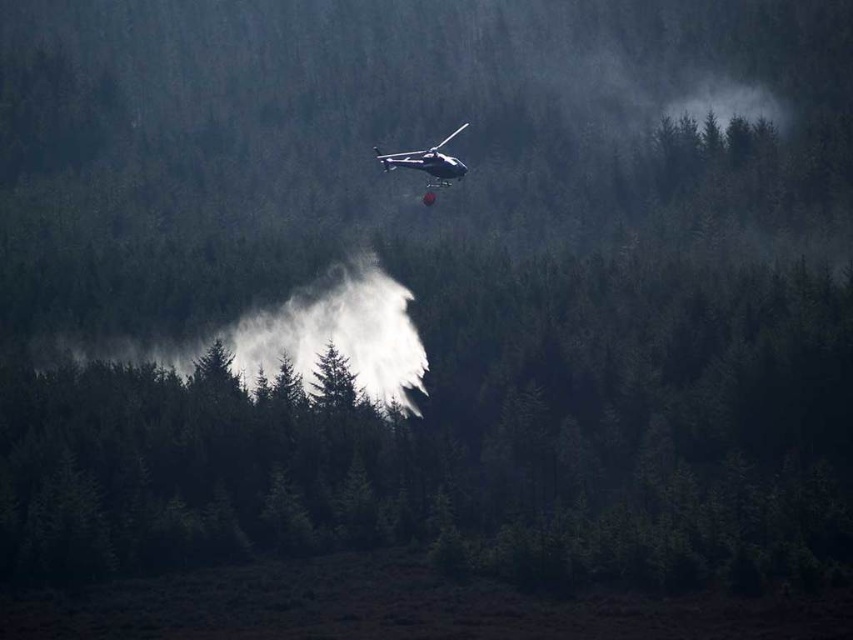
Question: Which object is closer to the camera taking this photo?

Choices:
 (A) metallic silver helicopter at center
 (B) white matte smoke at center

Answer: (A)

Question: Does white matte smoke at center have a larger size compared to metallic silver helicopter at center?

Choices:
 (A) yes
 (B) no

Answer: (A)

Question: Is white matte smoke at center closer to camera compared to metallic silver helicopter at center?

Choices:
 (A) no
 (B) yes

Answer: (A)

Question: Which of the following is the closest to the observer?

Choices:
 (A) (55, 344)
 (B) (415, 163)

Answer: (B)

Question: Is white matte smoke at center above metallic silver helicopter at center?

Choices:
 (A) no
 (B) yes

Answer: (A)

Question: Which object appears closest to the camera in this image?

Choices:
 (A) metallic silver helicopter at center
 (B) white matte smoke at center

Answer: (A)